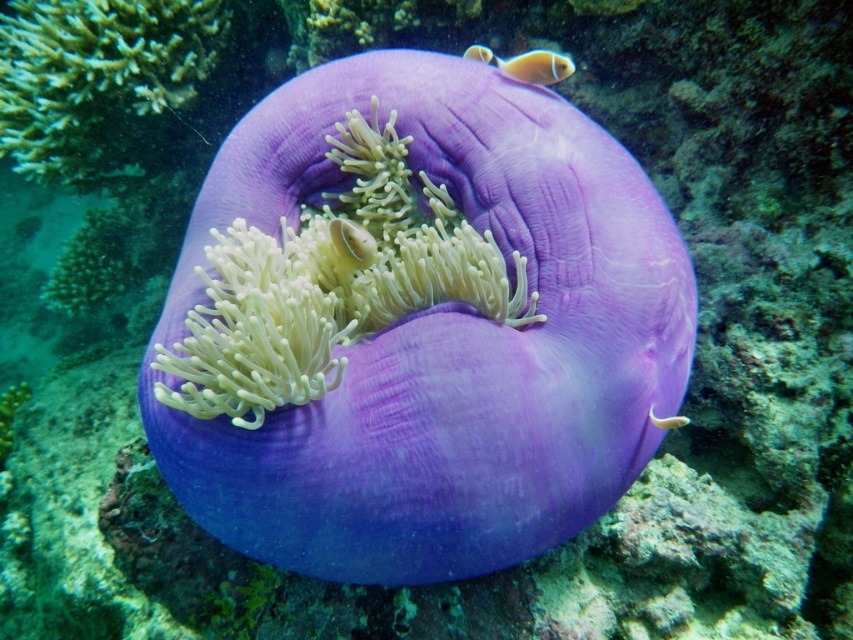
You are a marine biologist observing this underwater scene. You notice an orange matte fish at upper right and a translucent white fish at center. Which fish is closer to the camera?

The orange matte fish at upper right is closer to the camera because the translucent white fish at center is behind it.

You are a scuba diver swimming in the underwater scene. You notice two points marked in the image. Point A is at coordinates point (415, 369) and Point B is at point (48, 177). If you want to reach Point B first, which direction should you swim relative to the anemone?

To reach Point B first, you should swim towards the direction away from the anemone since Point B is behind Point A. Since Point A is in front of Point B, moving away from the anemone would bring you closer to Point B.

You are a scuba diver swimming in the underwater scene. You see the green coral at upper left and the orange matte fish at upper right. Which object is positioned to the left of the other?

The green coral at upper left is positioned to the left of the orange matte fish at upper right.